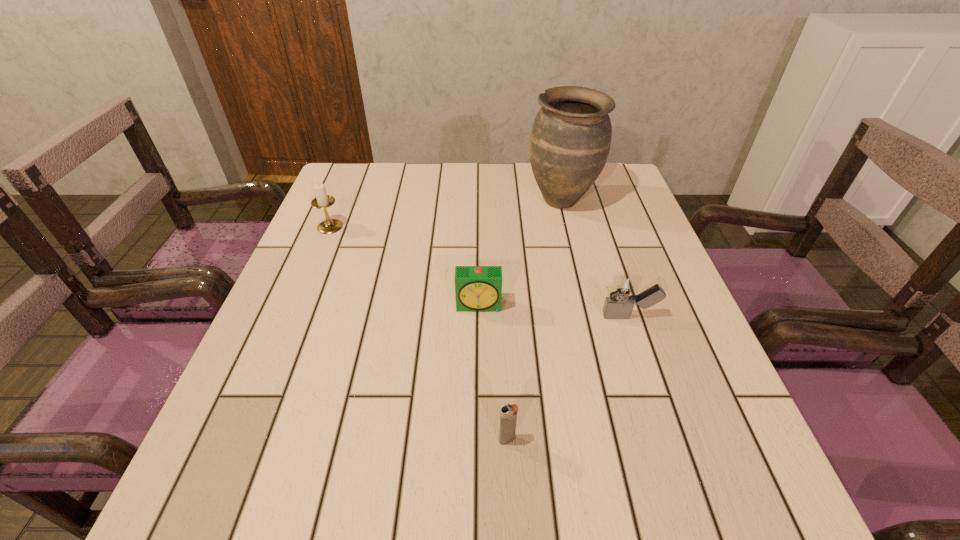
Where is `vacant point located between the tallest object and the candle holder`? vacant point located between the tallest object and the candle holder is located at coordinates (445, 213).

Where is `free space between the leftmost object and the alarm clock`? Image resolution: width=960 pixels, height=540 pixels. free space between the leftmost object and the alarm clock is located at coordinates (405, 266).

You are a GUI agent. You are given a task and a screenshot of the screen. Output one action in this format:
    pyautogui.click(x=<x>, y=<y>)
    Task: Click on the unoccupied position between the tallest object and the candle holder
    Image resolution: width=960 pixels, height=540 pixels.
    Given the screenshot: What is the action you would take?
    pyautogui.click(x=445, y=213)

Choose which object is the second nearest neighbor to the candle holder. Please provide its 2D coordinates. Your answer should be formatted as a tuple, i.e. [(x, y)], where the tuple contains the x and y coordinates of a point satisfying the conditions above.

[(570, 139)]

The width and height of the screenshot is (960, 540). I want to click on the fourth closest object to the alarm clock, so click(x=322, y=201).

Identify the location of vacant space that satisfies the following two spatial constraints: 1. on the front-facing side of the taller igniter; 2. on the right side of the alarm clock. The image size is (960, 540). (480, 316).

Where is `free space that satisfies the following two spatial constraints: 1. on the front-facing side of the taller igniter; 2. on the right side of the alarm clock`? The image size is (960, 540). free space that satisfies the following two spatial constraints: 1. on the front-facing side of the taller igniter; 2. on the right side of the alarm clock is located at coordinates (480, 316).